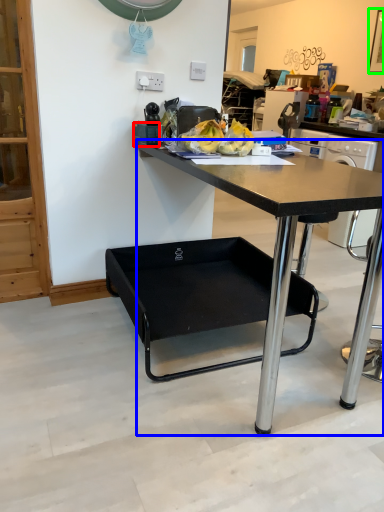
Question: Based on their relative distances, which object is nearer to tableware (highlighted by a red box)? Choose from desk (highlighted by a blue box) and picture frame (highlighted by a green box).

Choices:
 (A) desk
 (B) picture frame

Answer: (A)